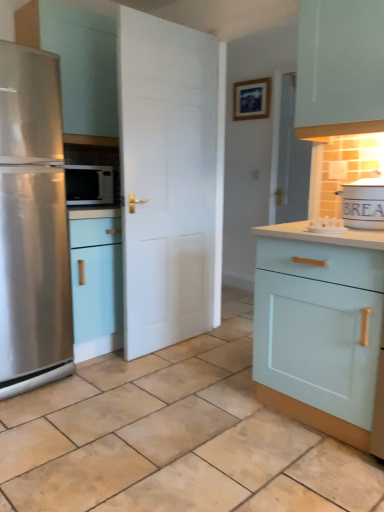
Locate an element on the screen. The image size is (384, 512). free point to the left of light blue wood cabinet at right is located at coordinates (212, 414).